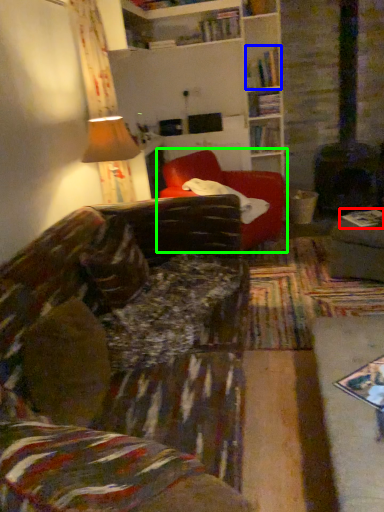
Question: Considering the real-world distances, which object is farthest from book (highlighted by a red box)? book (highlighted by a blue box) or studio couch (highlighted by a green box)?

Choices:
 (A) book
 (B) studio couch

Answer: (A)